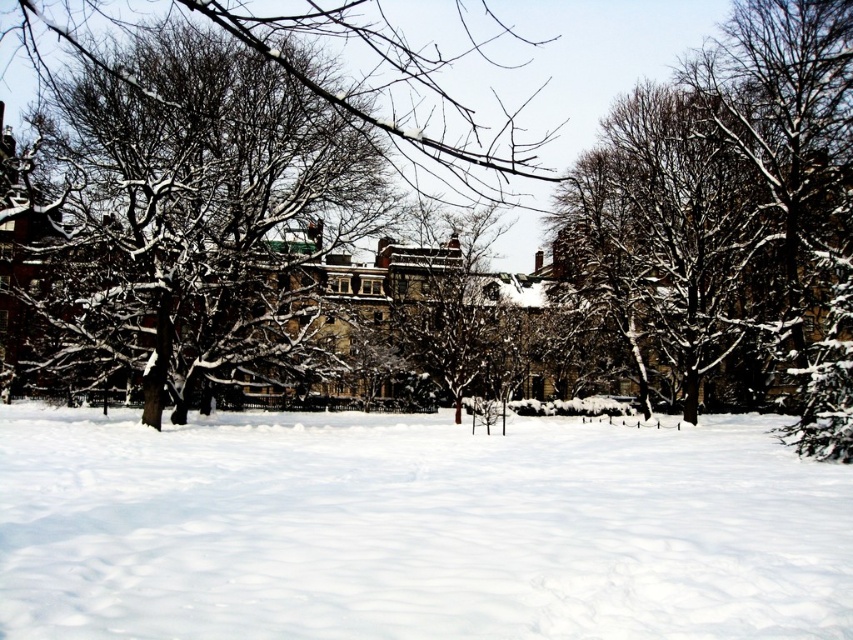
You are standing at the center of the winter scene and see a point marked at coordinates (415, 529). What is the surface type at that point?

The point at (415, 529) is on white fluffy snow at center.